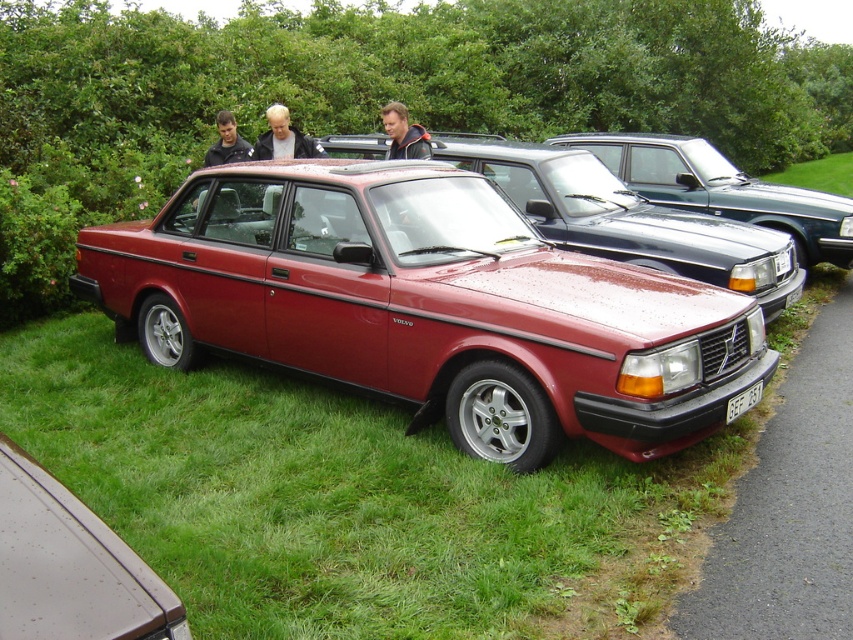
Question: Observing the image, what is the correct spatial positioning of blonde hair at center in reference to white plastic license plate at center?

Choices:
 (A) right
 (B) left

Answer: (B)

Question: Which point is closer to the camera?

Choices:
 (A) blonde hair at center
 (B) leather jacket at center

Answer: (B)

Question: Which point appears closest to the camera in this image?

Choices:
 (A) (727, 196)
 (B) (297, 140)
 (C) (786, 259)
 (D) (399, 109)

Answer: (C)

Question: Which object is the farthest from the metallic silver car at lower left?

Choices:
 (A) matte black jacket at upper center
 (B) blonde hair at center
 (C) green grass at lower right

Answer: (C)

Question: Is metallic red sedan at center to the right of blonde hair at center from the viewer's perspective?

Choices:
 (A) yes
 (B) no

Answer: (A)

Question: Can you confirm if satin red car at center is positioned to the left of green grass at lower right?

Choices:
 (A) no
 (B) yes

Answer: (B)